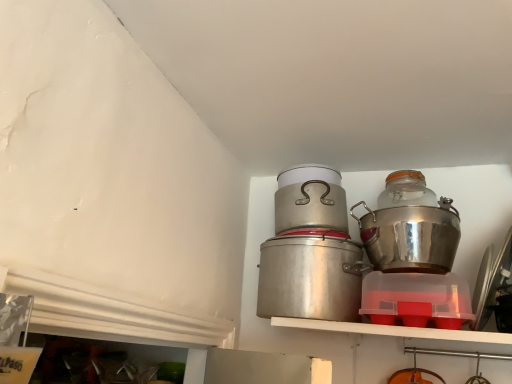
Measure the distance between point [343,204] and camera.

Point [343,204] is 1.60 meters away from camera.

The image size is (512, 384). I want to click on transparent glass jar at upper right, so click(406, 190).

Locate an element on the screen. metallic silver pot at center is located at coordinates (310, 199).

From the picture: Is shiny metallic pot at right, the 2th crock pot positioned from the left, in front of or behind silver metallic crock pot at center, the 2th crock pot when ordered from right to left, in the image?

shiny metallic pot at right, the 2th crock pot positioned from the left, is in front of silver metallic crock pot at center, the 2th crock pot when ordered from right to left.

Measure the distance between shiny metallic pot at right, the first crock pot in the right-to-left sequence, and silver metallic crock pot at center, the 2th crock pot when ordered from right to left.

shiny metallic pot at right, the first crock pot in the right-to-left sequence, and silver metallic crock pot at center, the 2th crock pot when ordered from right to left, are 7.98 inches apart from each other.

Looking at this image, is silver metallic crock pot at center, the 2th crock pot when ordered from right to left, at the back of shiny metallic pot at right, the 2th crock pot positioned from the left?

No, shiny metallic pot at right, the 2th crock pot positioned from the left,'s orientation is not away from silver metallic crock pot at center, the 2th crock pot when ordered from right to left.

Is shiny metallic pot at right, the first crock pot in the right-to-left sequence, far away from silver metallic crock pot at center, the first crock pot viewed from the left?

No, shiny metallic pot at right, the first crock pot in the right-to-left sequence, is not far away from silver metallic crock pot at center, the first crock pot viewed from the left.

Is point (418, 172) farther from viewer compared to point (389, 232)?

Yes, it is.

Which object is wider, transparent glass jar at upper right or shiny metallic pot at right, the 2th crock pot positioned from the left?

Wider between the two is shiny metallic pot at right, the 2th crock pot positioned from the left.

I want to click on crock pot that is the 1st one below the transparent glass jar at upper right (from a real-world perspective), so click(x=410, y=237).

Which of these two, transparent glass jar at upper right or shiny metallic pot at right, the first crock pot in the right-to-left sequence, is smaller?

transparent glass jar at upper right.

From a real-world perspective, is silver metallic crock pot at center, the first crock pot viewed from the left, physically below transparent glass jar at upper right?

Yes.

How many degrees apart are the facing directions of silver metallic crock pot at center, the 2th crock pot when ordered from right to left, and transparent glass jar at upper right?

The facing directions of silver metallic crock pot at center, the 2th crock pot when ordered from right to left, and transparent glass jar at upper right are 0.00125 degrees apart.

From the image's perspective, is silver metallic crock pot at center, the first crock pot viewed from the left, above or below transparent glass jar at upper right?

Clearly, from the image's perspective, silver metallic crock pot at center, the first crock pot viewed from the left, is below transparent glass jar at upper right.

Considering the positions of points (281, 186) and (417, 175), is point (281, 186) closer to camera compared to point (417, 175)?

That is True.

Consider the image. Considering the sizes of metallic silver pot at center and transparent glass jar at upper right in the image, is metallic silver pot at center bigger or smaller than transparent glass jar at upper right?

Considering their sizes, metallic silver pot at center takes up more space than transparent glass jar at upper right.

Do you think metallic silver pot at center is within transparent glass jar at upper right, or outside of it?

metallic silver pot at center cannot be found inside transparent glass jar at upper right.

In the scene shown: From the image's perspective, is metallic silver pot at center located beneath transparent glass jar at upper right?

Yes, from the image's perspective, metallic silver pot at center is beneath transparent glass jar at upper right.

Looking at this image, is silver metallic crock pot at center, the first crock pot viewed from the left, touching shiny metallic pot at right, the 2th crock pot positioned from the left?

No, silver metallic crock pot at center, the first crock pot viewed from the left, is not in contact with shiny metallic pot at right, the 2th crock pot positioned from the left.

Choose the correct answer: Is silver metallic crock pot at center, the first crock pot viewed from the left, inside shiny metallic pot at right, the first crock pot in the right-to-left sequence, or outside it?

silver metallic crock pot at center, the first crock pot viewed from the left, is spatially situated outside shiny metallic pot at right, the first crock pot in the right-to-left sequence.

In the scene shown: Who is smaller, silver metallic crock pot at center, the first crock pot viewed from the left, or shiny metallic pot at right, the first crock pot in the right-to-left sequence?

shiny metallic pot at right, the first crock pot in the right-to-left sequence.

You are a GUI agent. You are given a task and a screenshot of the screen. Output one action in this format:
    pyautogui.click(x=<x>, y=<y>)
    Task: Click on the crock pot in front of the silver metallic crock pot at center, the 2th crock pot when ordered from right to left
    Image resolution: width=512 pixels, height=384 pixels.
    Given the screenshot: What is the action you would take?
    pyautogui.click(x=410, y=237)

Is metallic silver pot at center thinner than silver metallic crock pot at center, the first crock pot viewed from the left?

Incorrect, the width of metallic silver pot at center is not less than that of silver metallic crock pot at center, the first crock pot viewed from the left.

Is metallic silver pot at center spatially inside silver metallic crock pot at center, the 2th crock pot when ordered from right to left, or outside of it?

Answer: metallic silver pot at center lies outside silver metallic crock pot at center, the 2th crock pot when ordered from right to left.

Considering the positions of objects metallic silver pot at center and silver metallic crock pot at center, the 2th crock pot when ordered from right to left, in the image provided, who is behind, metallic silver pot at center or silver metallic crock pot at center, the 2th crock pot when ordered from right to left,?

metallic silver pot at center is further away from the camera.

Would you consider metallic silver pot at center to be distant from silver metallic crock pot at center, the first crock pot viewed from the left?

metallic silver pot at center is near silver metallic crock pot at center, the first crock pot viewed from the left, not far away.

Is metallic silver pot at center at the back of silver metallic crock pot at center, the first crock pot viewed from the left?

No.

Is silver metallic crock pot at center, the first crock pot viewed from the left, positioned before metallic silver pot at center?

Yes, it is.

Can metallic silver pot at center be found inside silver metallic crock pot at center, the first crock pot viewed from the left?

That's incorrect, metallic silver pot at center is not inside silver metallic crock pot at center, the first crock pot viewed from the left.

Identify the location of appliance on the right of silver metallic crock pot at center, the first crock pot viewed from the left. This screenshot has width=512, height=384. (310, 199).

I want to click on crock pot below the shiny metallic pot at right, the first crock pot in the right-to-left sequence (from a real-world perspective), so click(x=310, y=278).

This screenshot has height=384, width=512. I want to click on bottle located on the right of shiny metallic pot at right, the first crock pot in the right-to-left sequence, so click(406, 190).

Based on their spatial positions, is transparent glass jar at upper right or shiny metallic pot at right, the 2th crock pot positioned from the left, further from silver metallic crock pot at center, the 2th crock pot when ordered from right to left?

transparent glass jar at upper right is further to silver metallic crock pot at center, the 2th crock pot when ordered from right to left.

In the scene shown: Estimate the real-world distances between objects in this image. Which object is closer to shiny metallic pot at right, the first crock pot in the right-to-left sequence, transparent glass jar at upper right or silver metallic crock pot at center, the 2th crock pot when ordered from right to left?

transparent glass jar at upper right.

From the image, which object appears to be nearer to silver metallic crock pot at center, the first crock pot viewed from the left, transparent glass jar at upper right or metallic silver pot at center?

metallic silver pot at center.

Based on the photo, when comparing their distances from shiny metallic pot at right, the first crock pot in the right-to-left sequence, does silver metallic crock pot at center, the 2th crock pot when ordered from right to left, or transparent glass jar at upper right seem further?

silver metallic crock pot at center, the 2th crock pot when ordered from right to left, is further to shiny metallic pot at right, the first crock pot in the right-to-left sequence.

Estimate the real-world distances between objects in this image. Which object is closer to metallic silver pot at center, shiny metallic pot at right, the 2th crock pot positioned from the left, or transparent glass jar at upper right?

shiny metallic pot at right, the 2th crock pot positioned from the left, is positioned closer to the anchor metallic silver pot at center.

From the image, which object appears to be farther from transparent glass jar at upper right, silver metallic crock pot at center, the first crock pot viewed from the left, or shiny metallic pot at right, the first crock pot in the right-to-left sequence?

silver metallic crock pot at center, the first crock pot viewed from the left, is further to transparent glass jar at upper right.

Estimate the real-world distances between objects in this image. Which object is closer to silver metallic crock pot at center, the 2th crock pot when ordered from right to left, shiny metallic pot at right, the first crock pot in the right-to-left sequence, or metallic silver pot at center?

metallic silver pot at center is closer to silver metallic crock pot at center, the 2th crock pot when ordered from right to left.

Estimate the real-world distances between objects in this image. Which object is further from shiny metallic pot at right, the 2th crock pot positioned from the left, silver metallic crock pot at center, the first crock pot viewed from the left, or metallic silver pot at center?

metallic silver pot at center is positioned further to the anchor shiny metallic pot at right, the 2th crock pot positioned from the left.

Find the location of a particular element. This screenshot has width=512, height=384. appliance situated between silver metallic crock pot at center, the first crock pot viewed from the left, and transparent glass jar at upper right from left to right is located at coordinates 310,199.

Identify the location of appliance between silver metallic crock pot at center, the first crock pot viewed from the left, and shiny metallic pot at right, the first crock pot in the right-to-left sequence, from left to right. (310, 199).

At what (x,y) coordinates should I click in order to perform the action: click on crock pot between metallic silver pot at center and transparent glass jar at upper right. Please return your answer as a coordinate pair (x, y). The image size is (512, 384). Looking at the image, I should click on (410, 237).

Identify the location of crock pot located between silver metallic crock pot at center, the first crock pot viewed from the left, and transparent glass jar at upper right in the left-right direction. (410, 237).